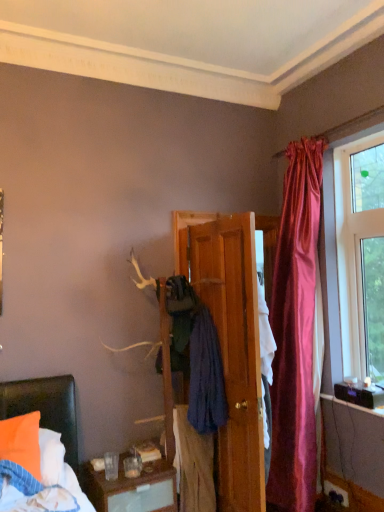
What is the approximate width of wooden door at center?

It is 30.50 inches.

What do you see at coordinates (197, 355) in the screenshot?
I see `blue cotton towel at center, acting as the 1th clothing starting from the top` at bounding box center [197, 355].

What do you see at coordinates (193, 465) in the screenshot? The image size is (384, 512). I see `blue cotton sweater at center, the 2th clothing in the top-to-bottom sequence` at bounding box center [193, 465].

Identify the location of wooden door at center. This screenshot has height=512, width=384. (232, 348).

From a real-world perspective, count 2nd clothings downward from the clear glass window at upper right and point to it. Please provide its 2D coordinates.

[(193, 465)]

Is clear glass window at upper right situated inside blue cotton sweater at center, the 2th clothing in the top-to-bottom sequence, or outside?

clear glass window at upper right is spatially situated outside blue cotton sweater at center, the 2th clothing in the top-to-bottom sequence.

How far apart are clear glass window at upper right and blue cotton sweater at center, the 2th clothing in the top-to-bottom sequence?

clear glass window at upper right and blue cotton sweater at center, the 2th clothing in the top-to-bottom sequence, are 1.40 meters apart from each other.

Is clear glass window at upper right taller than blue cotton sweater at center, the 2th clothing in the top-to-bottom sequence?

Indeed, clear glass window at upper right has a greater height compared to blue cotton sweater at center, the 2th clothing in the top-to-bottom sequence.

Considering the positions of point (236, 346) and point (382, 229), is point (236, 346) closer or farther from the camera than point (382, 229)?

Point (236, 346).

Is wooden door at center facing towards clear glass window at upper right?

No, wooden door at center is not aimed at clear glass window at upper right.

Is the surface of wooden door at center in direct contact with clear glass window at upper right?

wooden door at center and clear glass window at upper right are clearly separated.

From the image's perspective, is matte black speaker at lower right located above or below blue cotton sweater at center, the 1th clothing positioned from the bottom?

From the image's perspective, matte black speaker at lower right appears above blue cotton sweater at center, the 1th clothing positioned from the bottom.

Measure the distance from matte black speaker at lower right to blue cotton sweater at center, the 1th clothing positioned from the bottom.

matte black speaker at lower right and blue cotton sweater at center, the 1th clothing positioned from the bottom, are 1.05 meters apart.

Identify the location of window sill above the blue cotton sweater at center, the 1th clothing positioned from the bottom (from the image's perspective). (354, 405).

Which is closer, (339, 402) or (180, 431)?

The point (180, 431) is closer.

Consider the image. Is wooden door at center bigger than matte black speaker at lower right?

Indeed, wooden door at center has a larger size compared to matte black speaker at lower right.

Which of these two, wooden door at center or matte black speaker at lower right, stands taller?

wooden door at center is taller.

From a real-world perspective, is wooden door at center over matte black speaker at lower right?

Indeed, from a real-world perspective, wooden door at center stands above matte black speaker at lower right.

Can you tell me how much blue cotton sweater at center, the 1th clothing positioned from the bottom, and wooden door at center differ in facing direction?

There is a 0.000473-degree angle between the facing directions of blue cotton sweater at center, the 1th clothing positioned from the bottom, and wooden door at center.

Is the surface of blue cotton sweater at center, the 1th clothing positioned from the bottom, in direct contact with wooden door at center?

No, blue cotton sweater at center, the 1th clothing positioned from the bottom, is not in contact with wooden door at center.

In terms of size, does blue cotton sweater at center, the 2th clothing in the top-to-bottom sequence, appear bigger or smaller than wooden door at center?

blue cotton sweater at center, the 2th clothing in the top-to-bottom sequence, is smaller than wooden door at center.

Considering the sizes of objects blue cotton sweater at center, the 2th clothing in the top-to-bottom sequence, and wooden door at center in the image provided, who is thinner, blue cotton sweater at center, the 2th clothing in the top-to-bottom sequence, or wooden door at center?

blue cotton sweater at center, the 2th clothing in the top-to-bottom sequence, is thinner.

Between wooden door at center and blue cotton sweater at center, the 1th clothing positioned from the bottom, which one has more height?

wooden door at center is taller.

Is wooden door at center positioned with its back to blue cotton sweater at center, the 2th clothing in the top-to-bottom sequence?

No.

Consider the image. Between wooden door at center and blue cotton sweater at center, the 2th clothing in the top-to-bottom sequence, which one has smaller width?

blue cotton sweater at center, the 2th clothing in the top-to-bottom sequence, is thinner.

Is wooden door at center far away from blue cotton sweater at center, the 1th clothing positioned from the bottom?

wooden door at center is actually quite close to blue cotton sweater at center, the 1th clothing positioned from the bottom.

Can you confirm if clear glass window at upper right is smaller than blue cotton towel at center, acting as the 1th clothing starting from the top?

Yes, clear glass window at upper right is smaller than blue cotton towel at center, acting as the 1th clothing starting from the top.

From a real-world perspective, relative to blue cotton towel at center, acting as the 1th clothing starting from the top, is clear glass window at upper right vertically above or below?

Clearly, from a real-world perspective, clear glass window at upper right is above blue cotton towel at center, acting as the 1th clothing starting from the top.

Is clear glass window at upper right positioned far away from blue cotton towel at center, acting as the second clothing starting from the bottom?

Indeed, clear glass window at upper right is not near blue cotton towel at center, acting as the second clothing starting from the bottom.

Would you say clear glass window at upper right is to the left or to the right of blue cotton towel at center, acting as the second clothing starting from the bottom, in the picture?

Clearly, clear glass window at upper right is on the right of blue cotton towel at center, acting as the second clothing starting from the bottom, in the image.

Locate an element on the screen. The width and height of the screenshot is (384, 512). the 2nd clothing in front when counting from the clear glass window at upper right is located at coordinates (193, 465).

Where is `door below the clear glass window at upper right (from a real-world perspective)`? The width and height of the screenshot is (384, 512). door below the clear glass window at upper right (from a real-world perspective) is located at coordinates (232, 348).

From the image, which object appears to be nearer to blue cotton towel at center, acting as the 1th clothing starting from the top, clear glass window at upper right or blue cotton sweater at center, the 2th clothing in the top-to-bottom sequence?

blue cotton sweater at center, the 2th clothing in the top-to-bottom sequence, is positioned closer to the anchor blue cotton towel at center, acting as the 1th clothing starting from the top.

Based on their spatial positions, is clear glass window at upper right or wooden door at center further from blue cotton towel at center, acting as the second clothing starting from the bottom?

Based on the image, clear glass window at upper right appears to be further to blue cotton towel at center, acting as the second clothing starting from the bottom.

Which object lies further to the anchor point clear glass window at upper right, wooden door at center or matte black speaker at lower right?

Among the two, wooden door at center is located further to clear glass window at upper right.

Which object lies nearer to the anchor point wooden door at center, matte black speaker at lower right or clear glass window at upper right?

clear glass window at upper right lies closer to wooden door at center than the other object.

From the image, which object appears to be farther from matte black speaker at lower right, blue cotton sweater at center, the 2th clothing in the top-to-bottom sequence, or wooden door at center?

blue cotton sweater at center, the 2th clothing in the top-to-bottom sequence, is further to matte black speaker at lower right.

Which object lies nearer to the anchor point matte black speaker at lower right, blue cotton towel at center, acting as the second clothing starting from the bottom, or blue cotton sweater at center, the 2th clothing in the top-to-bottom sequence?

Among the two, blue cotton towel at center, acting as the second clothing starting from the bottom, is located nearer to matte black speaker at lower right.

Which object lies nearer to the anchor point matte black speaker at lower right, clear glass window at upper right or blue cotton towel at center, acting as the second clothing starting from the bottom?

clear glass window at upper right is positioned closer to the anchor matte black speaker at lower right.

From the image, which object appears to be nearer to blue cotton sweater at center, the 1th clothing positioned from the bottom, wooden door at center or matte black speaker at lower right?

wooden door at center is positioned closer to the anchor blue cotton sweater at center, the 1th clothing positioned from the bottom.

Where is `window sill located between blue cotton towel at center, acting as the second clothing starting from the bottom, and clear glass window at upper right in the left-right direction`? The width and height of the screenshot is (384, 512). window sill located between blue cotton towel at center, acting as the second clothing starting from the bottom, and clear glass window at upper right in the left-right direction is located at coordinates (354, 405).

Image resolution: width=384 pixels, height=512 pixels. In order to click on door between blue cotton sweater at center, the 1th clothing positioned from the bottom, and matte black speaker at lower right, in the horizontal direction in this screenshot , I will do `click(232, 348)`.

You are a GUI agent. You are given a task and a screenshot of the screen. Output one action in this format:
    pyautogui.click(x=<x>, y=<y>)
    Task: Click on the window sill between wooden door at center and clear glass window at upper right from left to right
    The image size is (384, 512).
    Given the screenshot: What is the action you would take?
    pyautogui.click(x=354, y=405)

This screenshot has width=384, height=512. Find the location of `window sill between blue cotton sweater at center, the 1th clothing positioned from the bottom, and clear glass window at upper right from left to right`. window sill between blue cotton sweater at center, the 1th clothing positioned from the bottom, and clear glass window at upper right from left to right is located at coordinates (354, 405).